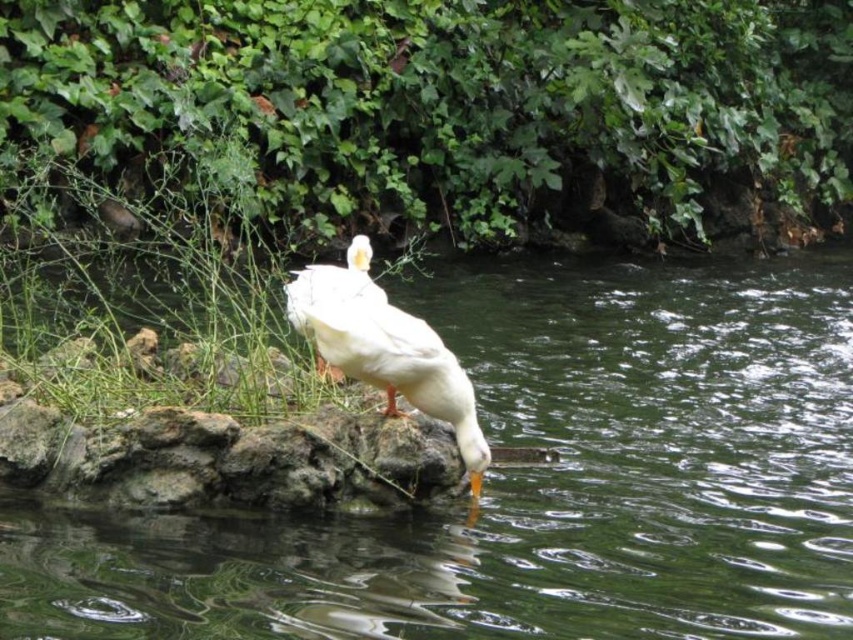
Which is more to the left, clear liquid water at center or white matte duck at center?

Positioned to the left is white matte duck at center.

Is clear liquid water at center above white matte duck at center?

Incorrect, clear liquid water at center is not positioned above white matte duck at center.

Identify the location of clear liquid water at center. (538, 483).